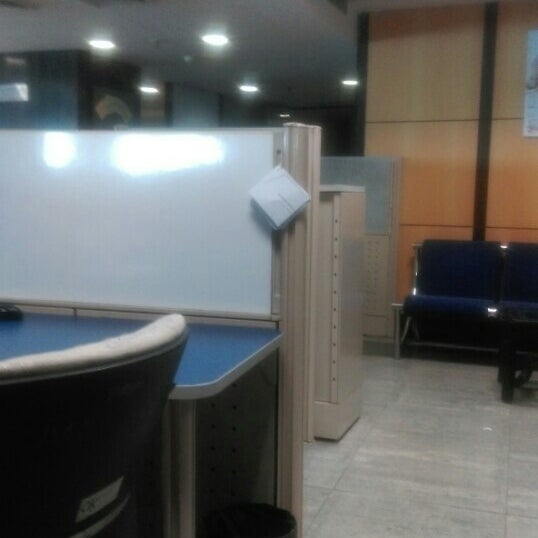
In order to click on faux wood panels in this screenshot , I will do `click(442, 51)`, `click(442, 174)`, `click(420, 235)`, `click(519, 235)`, `click(508, 178)`, `click(506, 88)`.